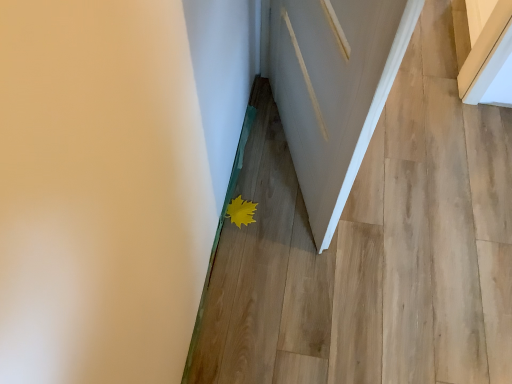
Question: Does matte white door at lower center have a greater height compared to yellow matte leaf at lower center?

Choices:
 (A) no
 (B) yes

Answer: (B)

Question: From the image's perspective, would you say matte white door at lower center is shown under yellow matte leaf at lower center?

Choices:
 (A) no
 (B) yes

Answer: (A)

Question: Can you confirm if matte white door at lower center is smaller than yellow matte leaf at lower center?

Choices:
 (A) no
 (B) yes

Answer: (A)

Question: Is matte white door at lower center further to the viewer compared to yellow matte leaf at lower center?

Choices:
 (A) no
 (B) yes

Answer: (A)

Question: From a real-world perspective, is matte white door at lower center under yellow matte leaf at lower center?

Choices:
 (A) yes
 (B) no

Answer: (A)

Question: Is white wood door at center taller or shorter than matte white door at lower center?

Choices:
 (A) short
 (B) tall

Answer: (B)

Question: From a real-world perspective, relative to matte white door at lower center, is white wood door at center vertically above or below?

Choices:
 (A) above
 (B) below

Answer: (A)

Question: From the image's perspective, relative to matte white door at lower center, is white wood door at center above or below?

Choices:
 (A) below
 (B) above

Answer: (B)

Question: Considering the positions of point (322, 198) and point (443, 307), is point (322, 198) closer or farther from the camera than point (443, 307)?

Choices:
 (A) closer
 (B) farther

Answer: (A)

Question: Based on their sizes in the image, would you say matte white door at lower center is bigger or smaller than yellow matte leaf at lower center?

Choices:
 (A) small
 (B) big

Answer: (B)

Question: Relative to yellow matte leaf at lower center, is matte white door at lower center in front or behind?

Choices:
 (A) behind
 (B) front

Answer: (B)

Question: Is point (355, 294) closer or farther from the camera than point (227, 210)?

Choices:
 (A) farther
 (B) closer

Answer: (B)

Question: From the image's perspective, is matte white door at lower center above or below yellow matte leaf at lower center?

Choices:
 (A) above
 (B) below

Answer: (A)

Question: Looking at the image, does yellow matte leaf at lower center seem bigger or smaller compared to white wood door at center?

Choices:
 (A) small
 (B) big

Answer: (A)

Question: Visually, is yellow matte leaf at lower center positioned to the left or to the right of white wood door at center?

Choices:
 (A) right
 (B) left

Answer: (B)